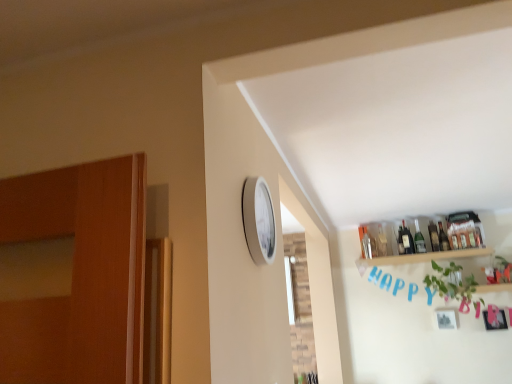
Question: Based on their sizes in the image, would you say translucent glass bottle at upper right, the 1th bottle in the left-to-right sequence, is bigger or smaller than wooden shelf at upper right?

Choices:
 (A) big
 (B) small

Answer: (B)

Question: Is translucent glass bottle at upper right, the 1th bottle in the left-to-right sequence, wider or thinner than wooden shelf at upper right?

Choices:
 (A) wide
 (B) thin

Answer: (B)

Question: Based on their relative distances, which object is farther from the green glass bottle at upper right, the 2th bottle when ordered from left to right?

Choices:
 (A) wooden shelf at upper right
 (B) translucent glass bottle at upper right, which ranks as the 4th bottle in right-to-left order
 (C) green leafy plant at upper right
 (D) translucent glass bottle at upper right, which is counted as the fourth bottle, starting from the left
 (E) green glass bottle at upper right, the third bottle when ordered from left to right

Answer: (C)

Question: Considering the real-world distances, which object is closest to the wooden shelf at upper right?

Choices:
 (A) green glass bottle at upper right, the 3th bottle positioned from the right
 (B) green glass bottle at upper right, the third bottle when ordered from left to right
 (C) green leafy plant at upper right
 (D) white plastic clock at upper center
 (E) translucent glass bottle at upper right, the 1th bottle in the left-to-right sequence

Answer: (E)